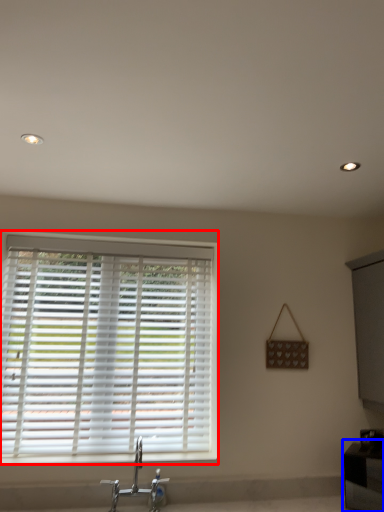
Question: Which object is closer to the camera taking this photo, window blind (highlighted by a red box) or vanity (highlighted by a blue box)?

Choices:
 (A) window blind
 (B) vanity

Answer: (B)